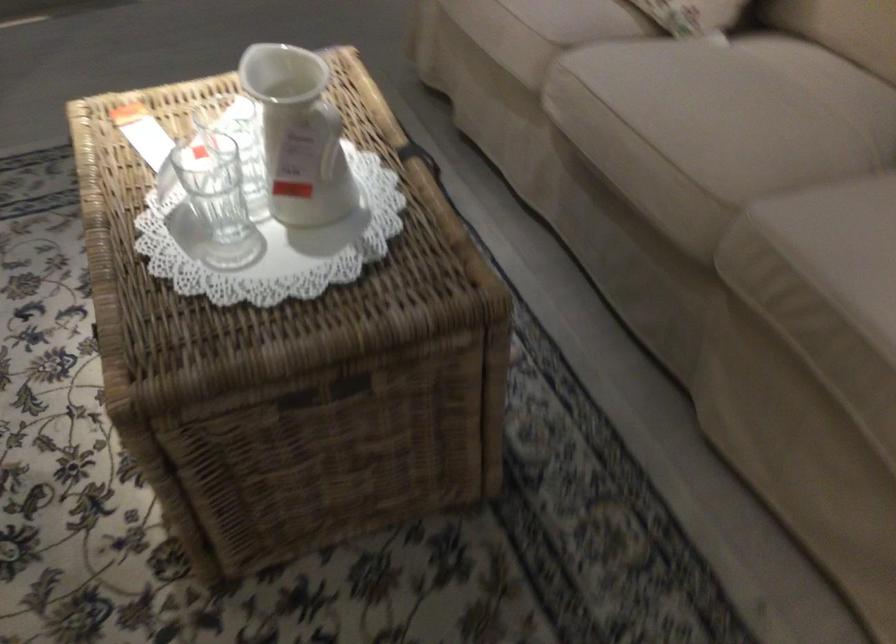
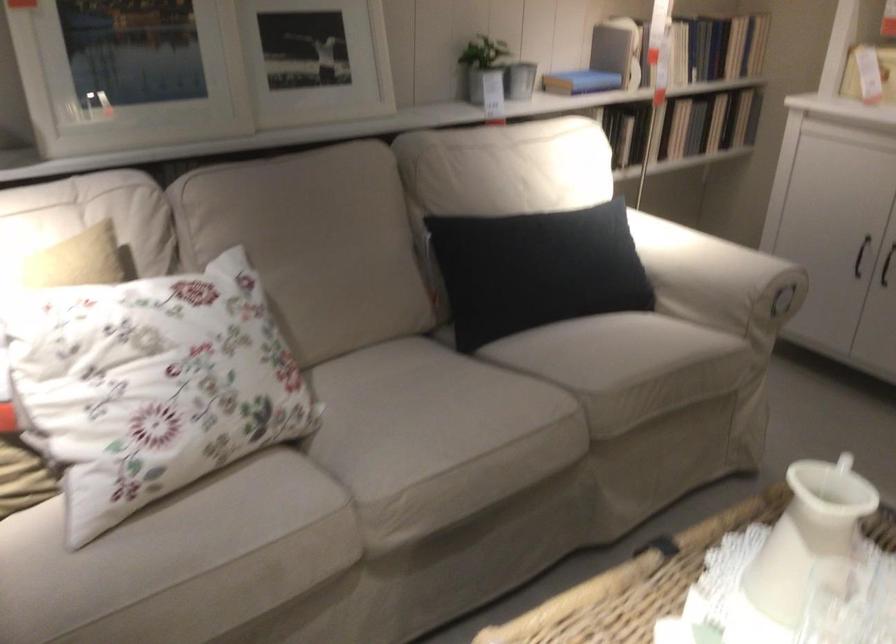
The point at (583, 80) is marked in the first image. Where is the corresponding point in the second image?

(398, 494)